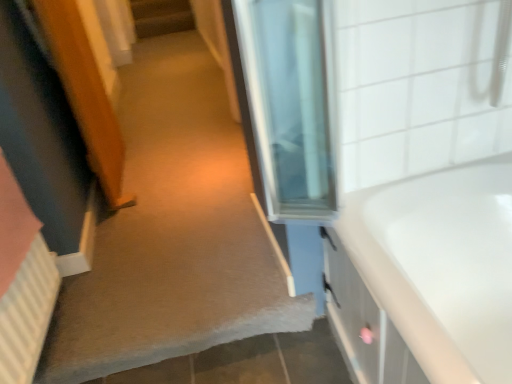
Locate an element on the screen. dark gray carpet at center is located at coordinates (161, 17).

Measure the distance between point (182, 7) and camera.

They are 5.41 meters apart.

What do you see at coordinates (161, 17) in the screenshot? The width and height of the screenshot is (512, 384). I see `dark gray carpet at center` at bounding box center [161, 17].

This screenshot has width=512, height=384. Find the location of `dark gray carpet at center`. dark gray carpet at center is located at coordinates (161, 17).